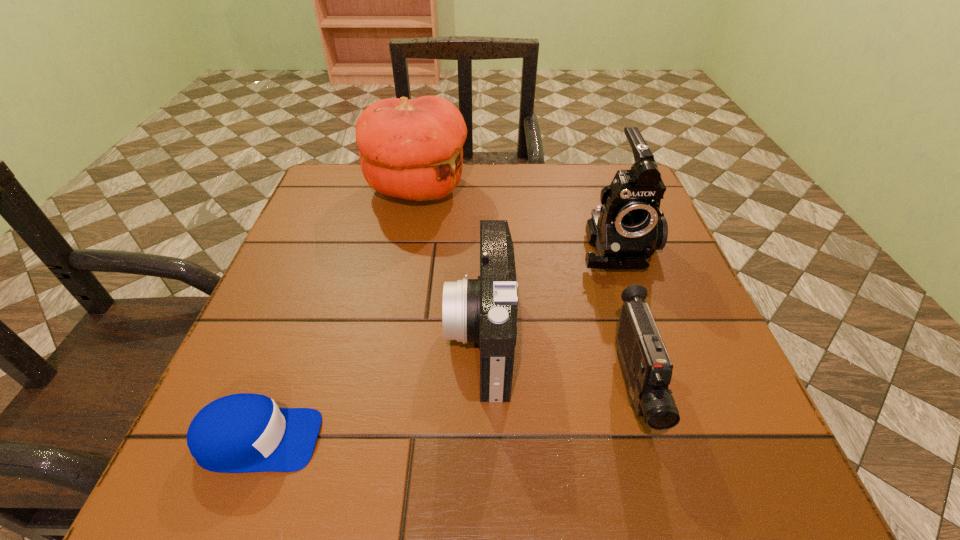
In order to click on vacant space located 0.130m on the lens of the third tallest object in this screenshot , I will do `click(374, 336)`.

Find the location of a particular element. This screenshot has width=960, height=540. blank space located 0.090m on the lens of the third tallest object is located at coordinates (396, 336).

Locate an element on the screen. The image size is (960, 540). vacant space located on the front-facing side of the second shortest object is located at coordinates (660, 487).

Identify the location of vacant region located on the front-facing side of the baseball cap. The height and width of the screenshot is (540, 960). (386, 440).

This screenshot has height=540, width=960. Identify the location of object that is at the far edge. (412, 149).

Where is `camcorder that is positioned at the near edge`? The width and height of the screenshot is (960, 540). camcorder that is positioned at the near edge is located at coordinates (647, 369).

Find the location of `baseball cap present at the near edge`. baseball cap present at the near edge is located at coordinates (239, 433).

You are a GUI agent. You are given a task and a screenshot of the screen. Output one action in this format:
    pyautogui.click(x=<x>, y=<y>)
    Task: Click on the pumpkin present at the left edge
    
    Given the screenshot: What is the action you would take?
    tap(412, 149)

Identify the location of baseball cap that is at the left edge. click(x=239, y=433).

Identify the location of object that is at the far left corner. This screenshot has width=960, height=540. (412, 149).